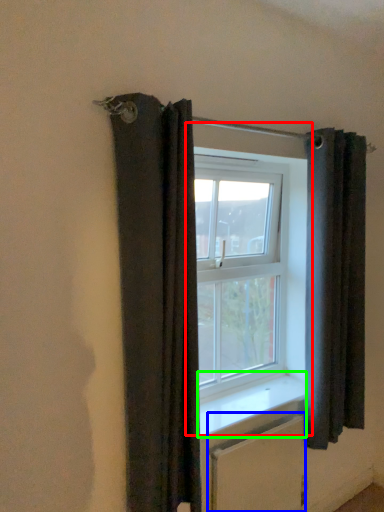
Question: Estimate the real-world distances between objects in this image. Which object is closer to window (highlighted by a red box), radiator (highlighted by a blue box) or window sill (highlighted by a green box)?

Choices:
 (A) radiator
 (B) window sill

Answer: (B)